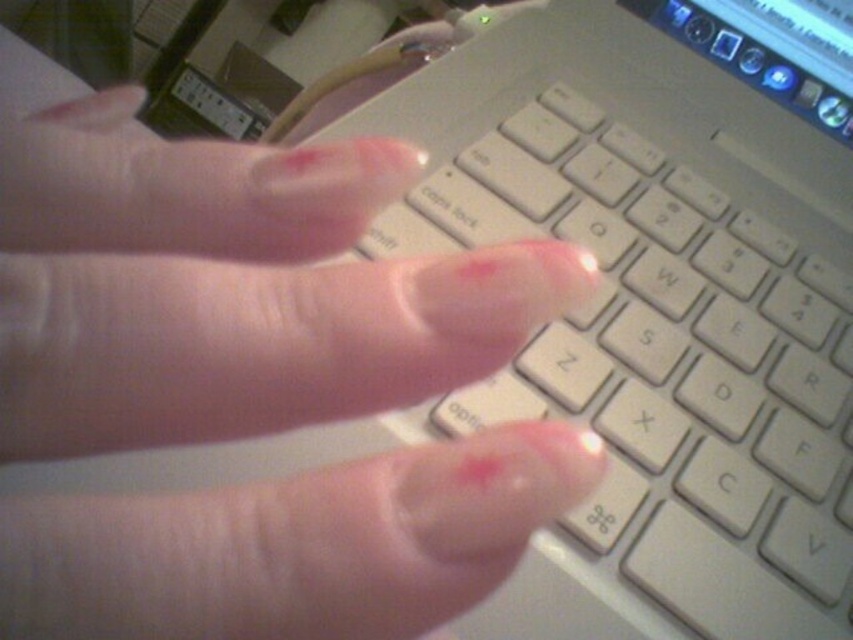
Question: Where is white plastic keyboard at center located in relation to clear skin at center in the image?

Choices:
 (A) below
 (B) above

Answer: (B)

Question: Is white plastic keyboard at center to the left of clear skin at center from the viewer's perspective?

Choices:
 (A) yes
 (B) no

Answer: (B)

Question: Which point is farther to the camera?

Choices:
 (A) white plastic keyboard at center
 (B) clear skin at center

Answer: (A)

Question: Does white plastic keyboard at center appear on the left side of clear skin at center?

Choices:
 (A) yes
 (B) no

Answer: (B)